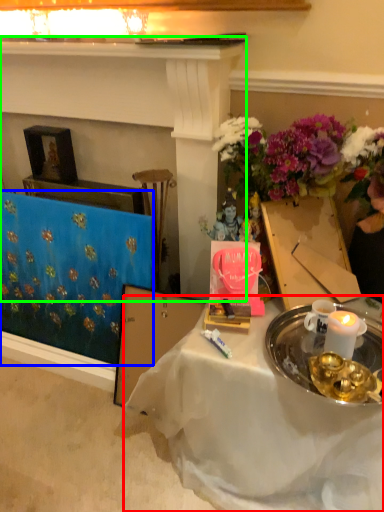
Question: Which is farther away from desk (highlighted by a red box)? tablecloth (highlighted by a blue box) or fireplace (highlighted by a green box)?

Choices:
 (A) tablecloth
 (B) fireplace

Answer: (B)